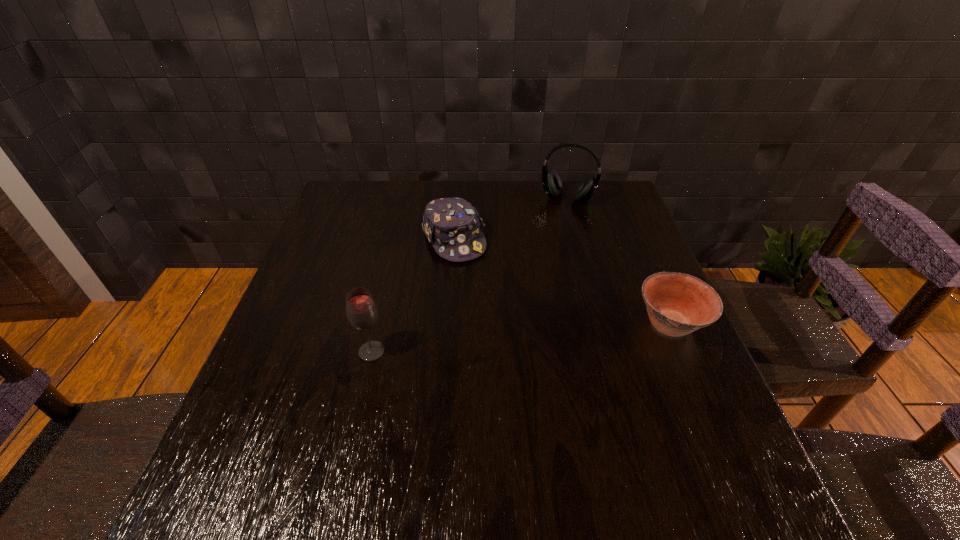
Locate an element on the screen. vacant space on the desktop that is between the glass drink container and the bowl and is positioned on the ear cups of the farthest object is located at coordinates (520, 338).

You are a GUI agent. You are given a task and a screenshot of the screen. Output one action in this format:
    pyautogui.click(x=<x>, y=<y>)
    Task: Click on the free space on the desktop that is between the leftmost object and the bowl and is positioned on the front-facing side of the headwear
    
    Given the screenshot: What is the action you would take?
    pyautogui.click(x=515, y=339)